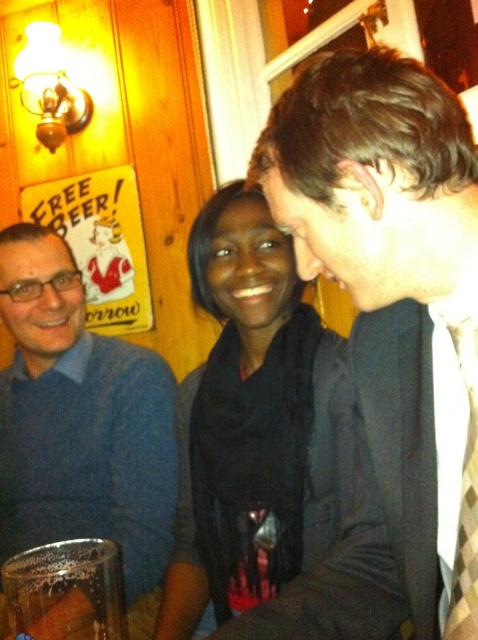
You are standing at the entrance of the bar and want to greet the person at point (209, 579). However, there is another person at point (26, 605) blocking your view. Can you see the first person from where you are standing?

Since point (209, 579) is behind point (26, 605), you cannot see the person at point (209, 579) because they are blocked by the person at point (26, 605).

Looking at this image, you are at the bar and want to grab the clear glass cup at lower left without moving the black matte scarf at center. Is the cup accessible?

The black matte scarf at center is to the right of the clear glass cup at lower left, so the cup is on the left side relative to the scarf. Since the scarf is not blocking the cup, you can reach the clear glass cup at lower left without moving the scarf.